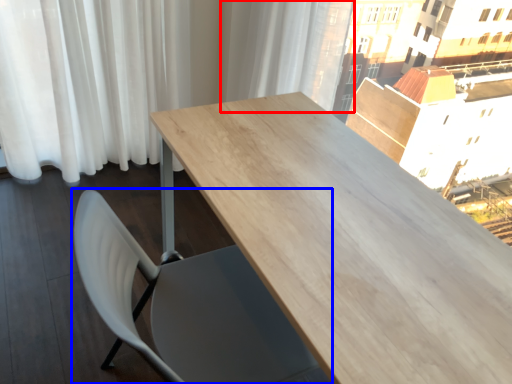
Question: Which object appears closest to the camera in this image, curtain (highlighted by a red box) or chair (highlighted by a blue box)?

Choices:
 (A) curtain
 (B) chair

Answer: (B)